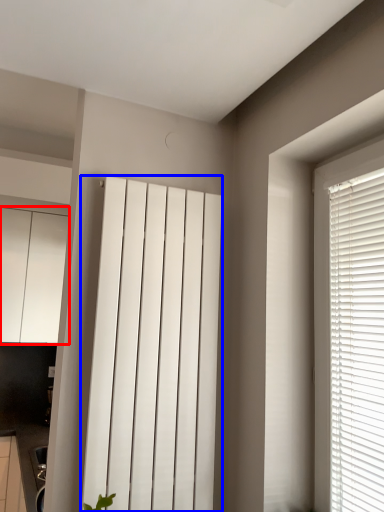
Question: Which of the following is the farthest to the observer, cabinetry (highlighted by a red box) or curtain (highlighted by a blue box)?

Choices:
 (A) cabinetry
 (B) curtain

Answer: (A)